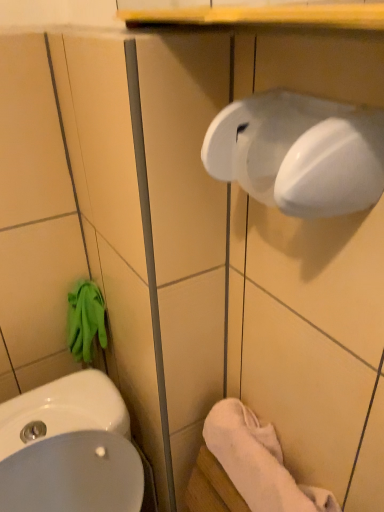
Question: Is white glossy sink at lower left positioned behind white soft towel at lower right?

Choices:
 (A) yes
 (B) no

Answer: (B)

Question: Is white glossy sink at lower left at the right side of white soft towel at lower right?

Choices:
 (A) yes
 (B) no

Answer: (B)

Question: Is white glossy sink at lower left positioned with its back to white soft towel at lower right?

Choices:
 (A) no
 (B) yes

Answer: (A)

Question: Is white glossy sink at lower left smaller than white soft towel at lower right?

Choices:
 (A) yes
 (B) no

Answer: (B)

Question: From a real-world perspective, is white glossy sink at lower left beneath white soft towel at lower right?

Choices:
 (A) no
 (B) yes

Answer: (B)

Question: From their relative heights in the image, would you say white soft towel at lower right is taller or shorter than white glossy hand dryer at upper right?

Choices:
 (A) tall
 (B) short

Answer: (A)

Question: Considering their positions, is white soft towel at lower right located in front of or behind white glossy hand dryer at upper right?

Choices:
 (A) behind
 (B) front

Answer: (A)

Question: Is white soft towel at lower right wider or thinner than white glossy hand dryer at upper right?

Choices:
 (A) wide
 (B) thin

Answer: (A)

Question: Would you say white soft towel at lower right is to the left or to the right of white glossy hand dryer at upper right in the picture?

Choices:
 (A) right
 (B) left

Answer: (A)

Question: Is white soft towel at lower right wider or thinner than white glossy sink at lower left?

Choices:
 (A) thin
 (B) wide

Answer: (A)

Question: Is white soft towel at lower right to the left or to the right of white glossy sink at lower left in the image?

Choices:
 (A) right
 (B) left

Answer: (A)

Question: Considering the positions of white soft towel at lower right and white glossy sink at lower left in the image, is white soft towel at lower right bigger or smaller than white glossy sink at lower left?

Choices:
 (A) big
 (B) small

Answer: (B)

Question: Relative to white glossy sink at lower left, is white soft towel at lower right in front or behind?

Choices:
 (A) front
 (B) behind

Answer: (B)

Question: From a real-world perspective, is white glossy sink at lower left above or below white soft towel at lower right?

Choices:
 (A) above
 (B) below

Answer: (B)

Question: Based on their positions, is white glossy sink at lower left located to the left or right of white soft towel at lower right?

Choices:
 (A) right
 (B) left

Answer: (B)